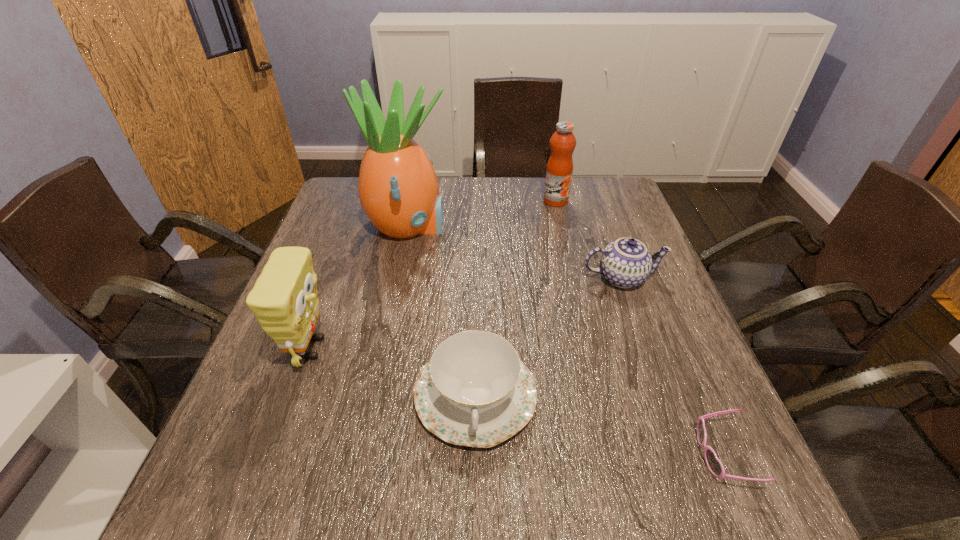
Locate an element on the screen. vacant area situated on the face of the sponge is located at coordinates (492, 348).

Where is `free space located at the spout of the right chinaware`? free space located at the spout of the right chinaware is located at coordinates (642, 336).

Identify the location of vacant space located on the handle side of the left chinaware. The width and height of the screenshot is (960, 540). (474, 507).

Where is `vacant space located 0.390m on the front-facing side of the sunglasses`? The image size is (960, 540). vacant space located 0.390m on the front-facing side of the sunglasses is located at coordinates (475, 455).

Find the location of `vacant space located 0.160m on the front-facing side of the sunglasses`. vacant space located 0.160m on the front-facing side of the sunglasses is located at coordinates (607, 455).

This screenshot has height=540, width=960. I want to click on free space located 0.320m on the front-facing side of the sunglasses, so click(x=515, y=455).

In order to click on pineapple present at the far edge in this screenshot , I will do `click(398, 189)`.

Where is `fruit juice present at the far edge`? The width and height of the screenshot is (960, 540). fruit juice present at the far edge is located at coordinates (559, 170).

You are a GUI agent. You are given a task and a screenshot of the screen. Output one action in this format:
    pyautogui.click(x=<x>, y=<y>)
    Task: Click on the object present at the near edge
    The width and height of the screenshot is (960, 540).
    Given the screenshot: What is the action you would take?
    pyautogui.click(x=714, y=465)

The image size is (960, 540). I want to click on pineapple at the left edge, so click(398, 189).